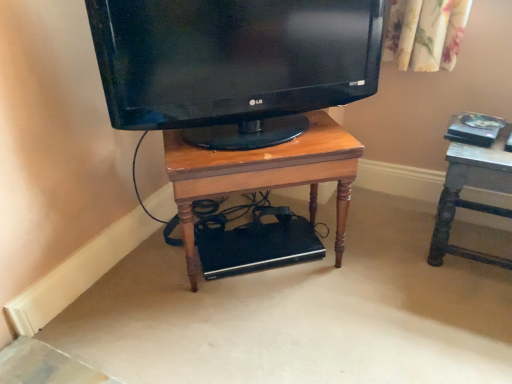
This screenshot has height=384, width=512. I want to click on blank space to the left of wooden table at right, so click(394, 249).